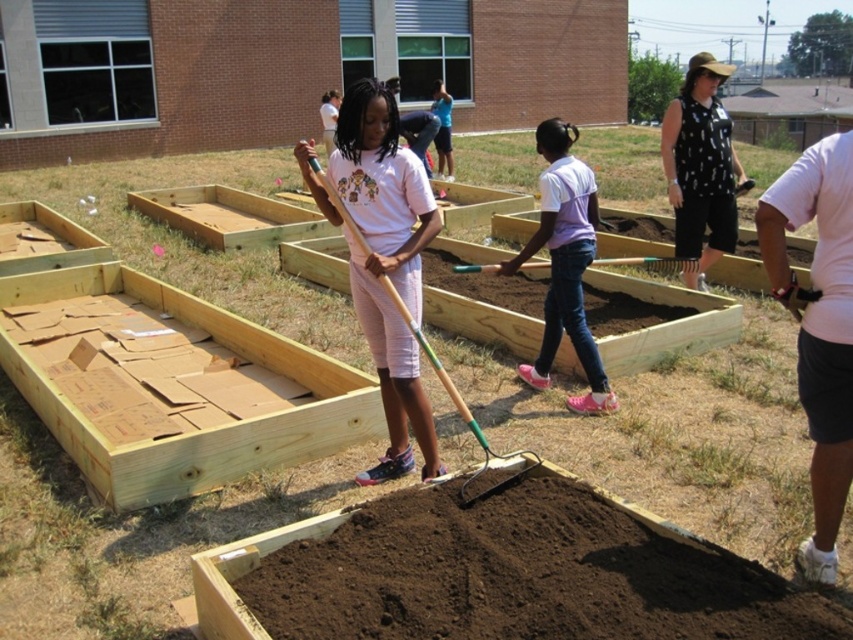
Locate an element on the screen. This screenshot has width=853, height=640. matte pink shirt at center is located at coordinates (387, 262).

What do you see at coordinates (387, 262) in the screenshot? Image resolution: width=853 pixels, height=640 pixels. I see `matte pink shirt at center` at bounding box center [387, 262].

Who is more distant from viewer, [349,109] or [489,269]?

The point [489,269] is behind.

I want to click on matte pink shirt at center, so click(x=387, y=262).

Who is lower down, pink cotton shirt at right or wooden shovel at center?

pink cotton shirt at right is below.

Who is taller, pink cotton shirt at right or wooden shovel at center?

With more height is pink cotton shirt at right.

Between point (831, 188) and point (381, 276), which one is positioned in front?

Point (831, 188) is more forward.

This screenshot has height=640, width=853. Find the location of `pink cotton shirt at right`. pink cotton shirt at right is located at coordinates 817,324.

Which of these two, pink cotton shirt at right or pink fabric shirt at center, stands taller?

pink fabric shirt at center

Does pink cotton shirt at right appear under pink fabric shirt at center?

Yes.

Identify the location of pink cotton shirt at right. This screenshot has height=640, width=853. (817, 324).